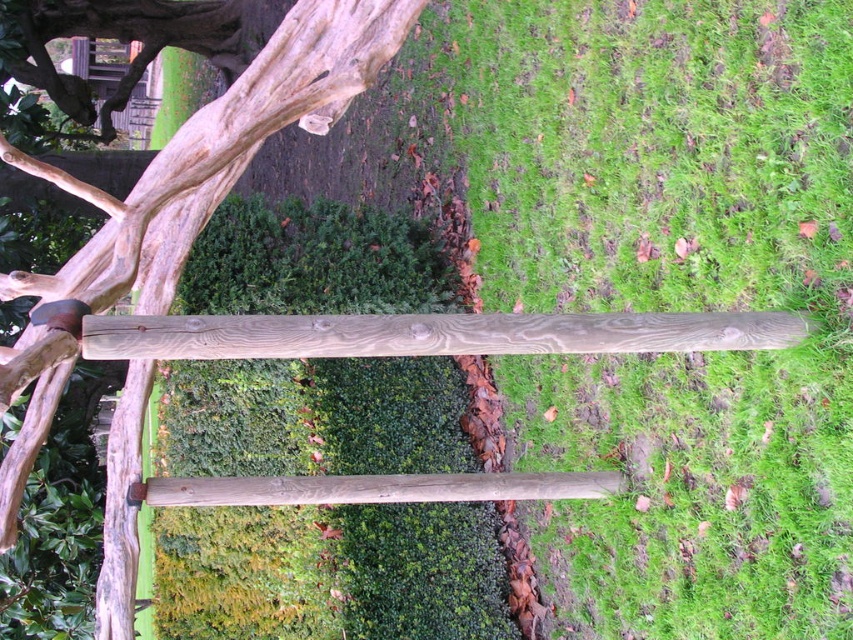
Consider the image. You are a gardener who wants to plant flowers between the green grass at center and the gray wood rail at center. Based on their positions, which object should you start working near first?

The green grass at center is positioned on the right side of gray wood rail at center, so you should start working near the gray wood rail at center first as it is to the left of the green grass at center.

You are standing in the garden and want to walk from the natural wood tree trunk at upper left to the green textured hedge at center. Which direction should you move?

You should move to the right to reach the green textured hedge at center from the natural wood tree trunk at upper left because the hedge is positioned to the right of the tree trunk.

Looking at this image, you are a gardener who needs to mow the lawn. You see the green grass at center and the natural wood tree trunk at upper left. Which area should you avoid mowing to prevent damaging the tree trunk?

You should avoid mowing near the natural wood tree trunk at upper left because the green grass at center is taller and more likely to require mowing, while the tree trunk is shorter and mowing there could damage it.